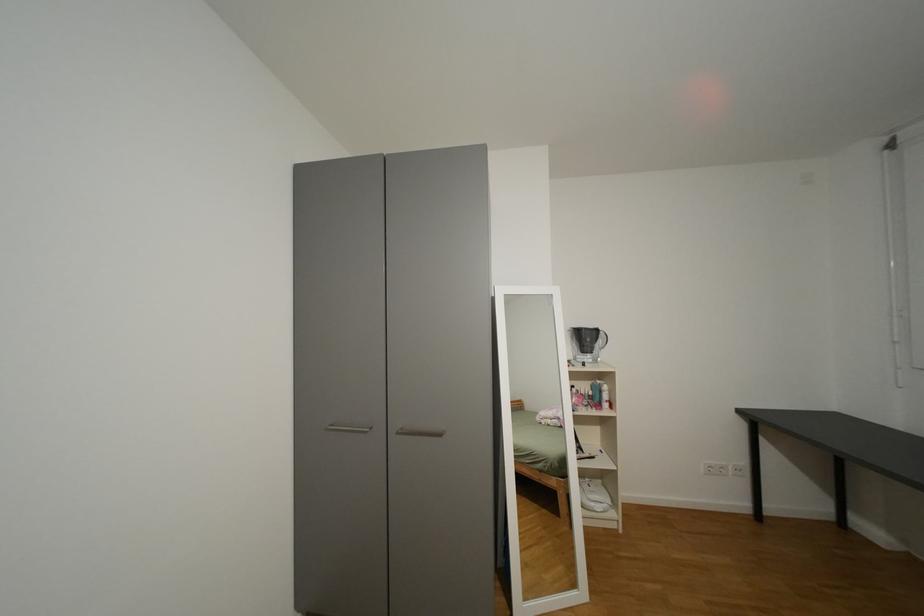
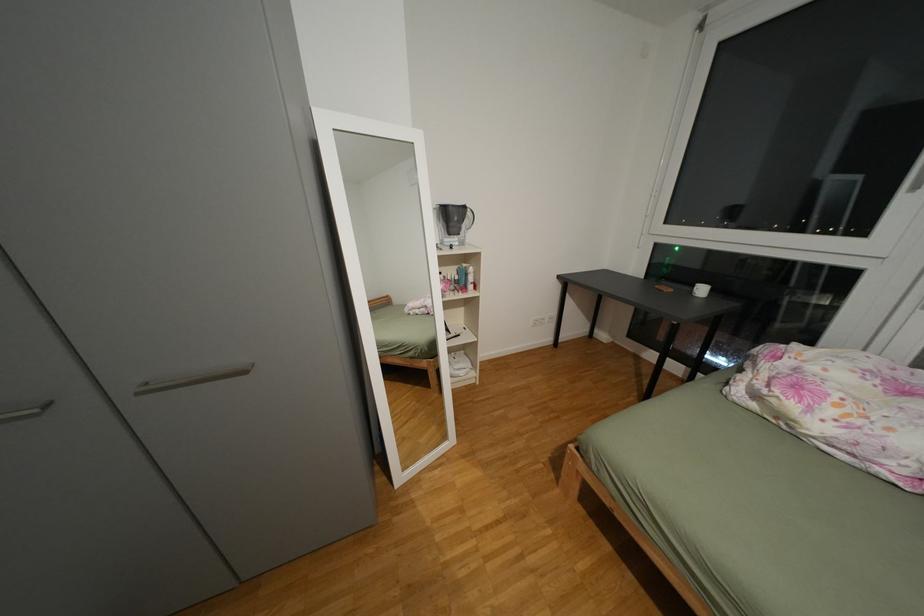
How did the camera likely rotate?

The rotation direction of the camera is right-down.